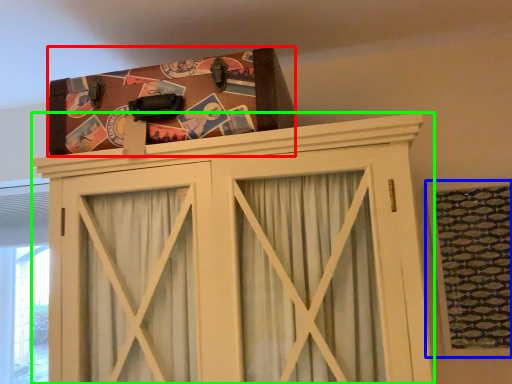
Question: Which object is positioned closest to package (highlighted by a red box)? Select from window (highlighted by a blue box) and cupboard (highlighted by a green box).

Choices:
 (A) window
 (B) cupboard

Answer: (B)